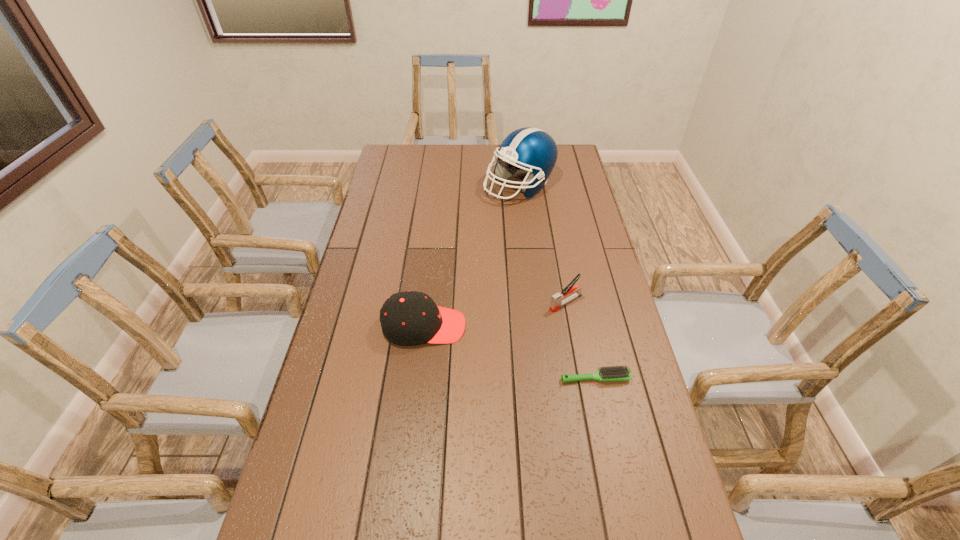
Where is `free spot on the desktop that is between the cap and the nearest object and is positioned on the handle side of the stapler`? This screenshot has height=540, width=960. free spot on the desktop that is between the cap and the nearest object and is positioned on the handle side of the stapler is located at coordinates (490, 346).

At what (x,y) coordinates should I click in order to perform the action: click on vacant space on the desktop that is between the cap and the shortest object and is positioned at the front of the tallest object with the faceguard. Please return your answer as a coordinate pair (x, y). The width and height of the screenshot is (960, 540). Looking at the image, I should click on (494, 347).